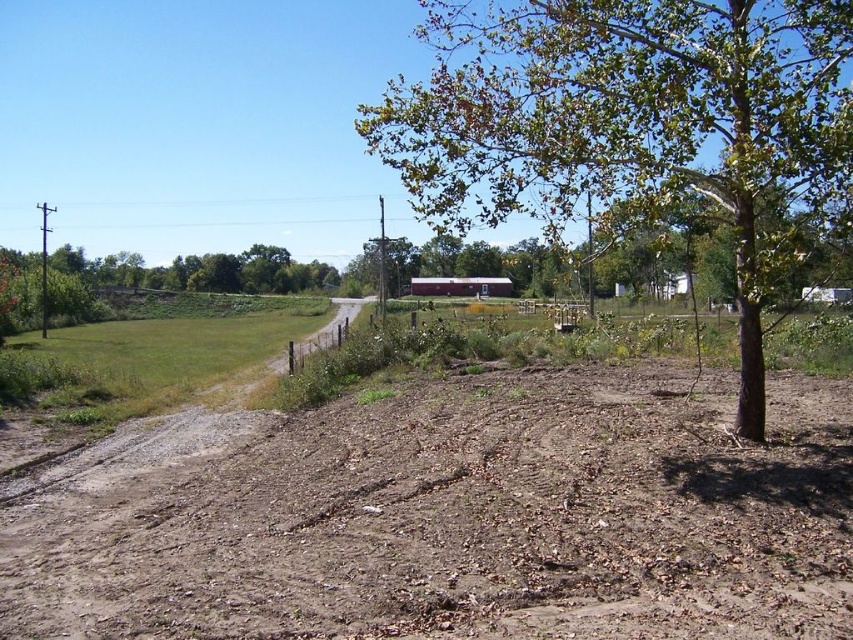
Question: In this image, where is brown soil at lower center located relative to green leafy tree at center?

Choices:
 (A) right
 (B) left

Answer: (B)

Question: Which of the following is the closest to the observer?

Choices:
 (A) brown soil at lower center
 (B) green leafy tree at center

Answer: (A)

Question: Does brown soil at lower center appear under green leafy tree at center?

Choices:
 (A) yes
 (B) no

Answer: (A)

Question: Which object appears farthest from the camera in this image?

Choices:
 (A) brown soil at lower center
 (B) green leafy tree at center

Answer: (B)

Question: Which point is closer to the camera?

Choices:
 (A) (485, 100)
 (B) (616, 624)

Answer: (B)

Question: Does brown soil at lower center appear on the right side of green leafy tree at center?

Choices:
 (A) yes
 (B) no

Answer: (B)